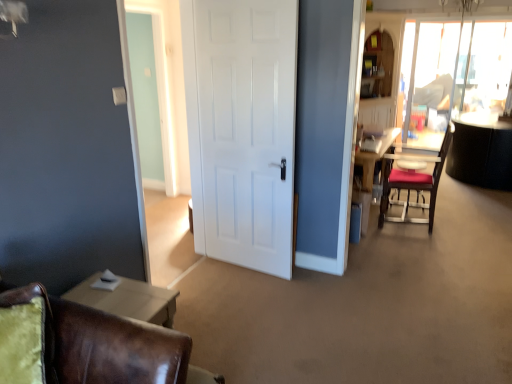
Describe the element at coordinates (413, 183) in the screenshot. This screenshot has height=384, width=512. I see `velvet red chair at right, acting as the second chair starting from the left` at that location.

This screenshot has width=512, height=384. Identify the location of white matte door at center. (242, 128).

Identify the location of transparent glass window screen at upper right. (433, 83).

Considering the sizes of objects transparent glass window screen at upper right and velvet red chair at right, which is counted as the 2th chair, starting from the bottom, in the image provided, who is wider, transparent glass window screen at upper right or velvet red chair at right, which is counted as the 2th chair, starting from the bottom,?

velvet red chair at right, which is counted as the 2th chair, starting from the bottom, is wider.

Is transparent glass window screen at upper right not inside velvet red chair at right, the first chair when ordered from right to left?

That's correct, transparent glass window screen at upper right is outside of velvet red chair at right, the first chair when ordered from right to left.

From the image's perspective, would you say transparent glass window screen at upper right is shown under velvet red chair at right, which is counted as the 2th chair, starting from the bottom?

No.

Is transparent glass window screen at upper right directly adjacent to velvet red chair at right, which is counted as the 2th chair, starting from the bottom?

No, transparent glass window screen at upper right is not in contact with velvet red chair at right, which is counted as the 2th chair, starting from the bottom.

Between point (106, 342) and point (439, 44), which one is positioned behind?

The point (439, 44) is behind.

Is brown leather chair at lower left, marked as the second chair in a back-to-front arrangement, not inside transparent glass window screen at upper right?

That's correct, brown leather chair at lower left, marked as the second chair in a back-to-front arrangement, is outside of transparent glass window screen at upper right.

In the image, is brown leather chair at lower left, arranged as the second chair when viewed from the top, positioned in front of or behind transparent glass window screen at upper right?

brown leather chair at lower left, arranged as the second chair when viewed from the top, is in front of transparent glass window screen at upper right.

From the image's perspective, is brown leather chair at lower left, arranged as the second chair when viewed from the right, above or below transparent glass window screen at upper right?

brown leather chair at lower left, arranged as the second chair when viewed from the right, is below transparent glass window screen at upper right.

Based on their positions, is velvet brown swivel chair at lower left located to the left or right of transparent glass window screen at upper right?

velvet brown swivel chair at lower left is to the left of transparent glass window screen at upper right.

Considering the relative sizes of velvet brown swivel chair at lower left and transparent glass window screen at upper right in the image provided, is velvet brown swivel chair at lower left smaller than transparent glass window screen at upper right?

Indeed, velvet brown swivel chair at lower left has a smaller size compared to transparent glass window screen at upper right.

Which is closer to the camera, (29, 328) or (446, 26)?

The point (29, 328) is closer.

Is velvet brown swivel chair at lower left far from transparent glass window screen at upper right?

Yes, velvet brown swivel chair at lower left and transparent glass window screen at upper right are quite far apart.

How different are the orientations of velvet red chair at right, which is counted as the 2th chair, starting from the bottom, and transparent glass window screen at upper right in degrees?

There is a 90.3-degree angle between the facing directions of velvet red chair at right, which is counted as the 2th chair, starting from the bottom, and transparent glass window screen at upper right.

From the image's perspective, which one is positioned lower, velvet red chair at right, positioned as the first chair in top-to-bottom order, or transparent glass window screen at upper right?

velvet red chair at right, positioned as the first chair in top-to-bottom order, appears lower in the image.

Who is smaller, velvet red chair at right, acting as the second chair starting from the left, or transparent glass window screen at upper right?

With smaller size is transparent glass window screen at upper right.

Which object is positioned more to the right, velvet red chair at right, positioned as the first chair in top-to-bottom order, or transparent glass window screen at upper right?

From the viewer's perspective, transparent glass window screen at upper right appears more on the right side.

Which object is closer to the camera, white matte door at center or velvet brown swivel chair at lower left?

velvet brown swivel chair at lower left.

Between white matte door at center and velvet brown swivel chair at lower left, which one has smaller width?

white matte door at center.

Looking at this image, from the image's perspective, which is below, white matte door at center or velvet brown swivel chair at lower left?

velvet brown swivel chair at lower left.

From the image's perspective, is velvet red chair at right, acting as the second chair starting from the left, over velvet brown swivel chair at lower left?

Yes, from the image's perspective, velvet red chair at right, acting as the second chair starting from the left, is over velvet brown swivel chair at lower left.

Consider the image. How far apart are velvet red chair at right, which is counted as the 2th chair, starting from the bottom, and velvet brown swivel chair at lower left?

3.32 meters.

Can you confirm if velvet red chair at right, which is counted as the 2th chair, starting from the bottom, is bigger than velvet brown swivel chair at lower left?

Indeed, velvet red chair at right, which is counted as the 2th chair, starting from the bottom, has a larger size compared to velvet brown swivel chair at lower left.

From a real-world perspective, relative to velvet brown swivel chair at lower left, is velvet red chair at right, the first chair when ordered from right to left, vertically above or below?

velvet red chair at right, the first chair when ordered from right to left, is below velvet brown swivel chair at lower left.

Is velvet brown swivel chair at lower left beside white matte door at center?

There is a gap between velvet brown swivel chair at lower left and white matte door at center.

From a real-world perspective, relative to white matte door at center, is velvet brown swivel chair at lower left vertically above or below?

From a real-world perspective, velvet brown swivel chair at lower left is physically below white matte door at center.

Find the location of a particular element. This screenshot has height=384, width=512. swivel chair to the left of white matte door at center is located at coordinates (26, 336).

The width and height of the screenshot is (512, 384). Find the location of `chair that is the 1st one when counting forward from the transparent glass window screen at upper right`. chair that is the 1st one when counting forward from the transparent glass window screen at upper right is located at coordinates (413, 183).

From the image's perspective, count 2nd chairs downward from the transparent glass window screen at upper right and point to it. Please provide its 2D coordinates.

[(86, 345)]

Estimate the real-world distances between objects in this image. Which object is closer to white matte door at center, brown leather chair at lower left, marked as the second chair in a back-to-front arrangement, or transparent glass window screen at upper right?

brown leather chair at lower left, marked as the second chair in a back-to-front arrangement, lies closer to white matte door at center than the other object.

Looking at the image, which one is located closer to white matte door at center, velvet red chair at right, positioned as the first chair in top-to-bottom order, or transparent glass window screen at upper right?

Among the two, velvet red chair at right, positioned as the first chair in top-to-bottom order, is located nearer to white matte door at center.

Which object lies nearer to the anchor point velvet red chair at right, which is counted as the 2th chair, starting from the bottom, velvet brown swivel chair at lower left or transparent glass window screen at upper right?

transparent glass window screen at upper right.

Estimate the real-world distances between objects in this image. Which object is further from velvet brown swivel chair at lower left, white matte door at center or transparent glass window screen at upper right?

The object further to velvet brown swivel chair at lower left is transparent glass window screen at upper right.

When comparing their distances from velvet brown swivel chair at lower left, does brown leather chair at lower left, arranged as the second chair when viewed from the top, or velvet red chair at right, the first chair when ordered from right to left, seem closer?

The object closer to velvet brown swivel chair at lower left is brown leather chair at lower left, arranged as the second chair when viewed from the top.

Estimate the real-world distances between objects in this image. Which object is further from white matte door at center, velvet red chair at right, acting as the second chair starting from the left, or velvet brown swivel chair at lower left?

velvet brown swivel chair at lower left is positioned further to the anchor white matte door at center.

Based on their spatial positions, is white matte door at center or brown leather chair at lower left, the 1th chair when ordered from front to back, closer to transparent glass window screen at upper right?

white matte door at center is positioned closer to the anchor transparent glass window screen at upper right.

Estimate the real-world distances between objects in this image. Which object is further from velvet brown swivel chair at lower left, white matte door at center or velvet red chair at right, positioned as the first chair in top-to-bottom order?

velvet red chair at right, positioned as the first chair in top-to-bottom order, lies further to velvet brown swivel chair at lower left than the other object.

Identify the location of door between velvet brown swivel chair at lower left and velvet red chair at right, acting as the 1th chair starting from the back. (242, 128).

Locate an element on the screen. chair positioned between brown leather chair at lower left, marked as the second chair in a back-to-front arrangement, and transparent glass window screen at upper right from near to far is located at coordinates coord(413,183).

Locate an element on the screen. chair positioned between white matte door at center and transparent glass window screen at upper right from near to far is located at coordinates (413, 183).

At what (x,y) coordinates should I click in order to perform the action: click on chair between velvet brown swivel chair at lower left and velvet red chair at right, positioned as the second chair in front-to-back order, from left to right. Please return your answer as a coordinate pair (x, y). Looking at the image, I should click on (86, 345).